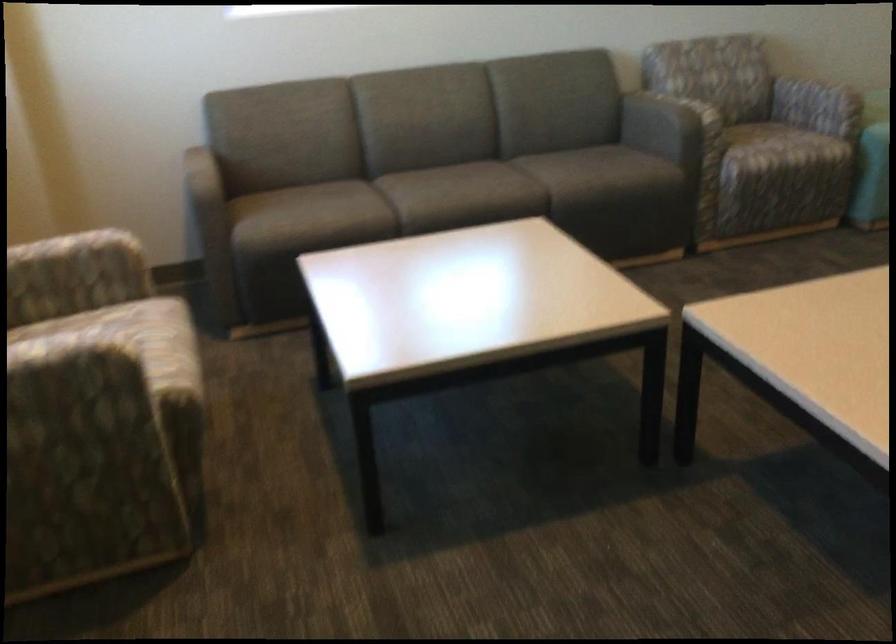
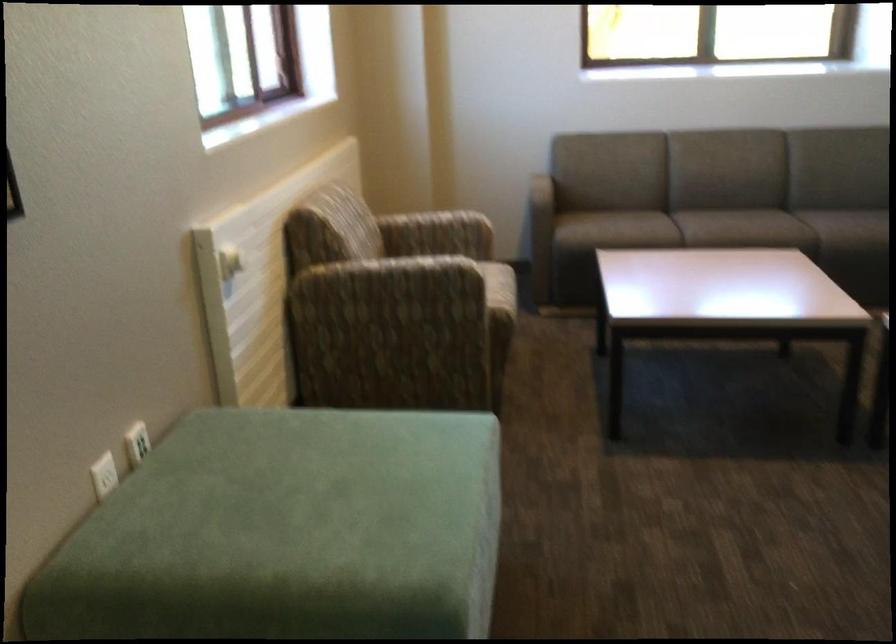
In the second image, find the point that corresponds to point 222,240 in the first image.

(540, 234)